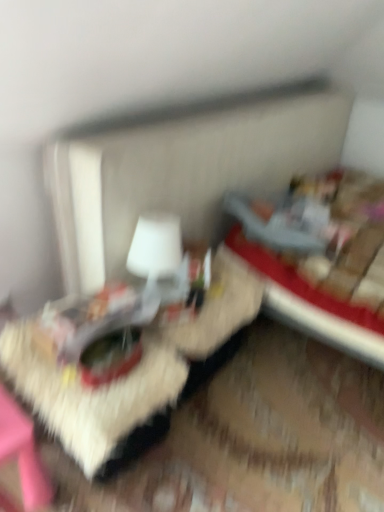
Question: Does velvet red bed at right have a lesser width compared to white matte table lamp at center?

Choices:
 (A) yes
 (B) no

Answer: (B)

Question: Does velvet red bed at right appear on the right side of white matte table lamp at center?

Choices:
 (A) no
 (B) yes

Answer: (B)

Question: Can we say velvet red bed at right lies outside white matte table lamp at center?

Choices:
 (A) no
 (B) yes

Answer: (B)

Question: Is velvet red bed at right facing away from white matte table lamp at center?

Choices:
 (A) no
 (B) yes

Answer: (A)

Question: Is velvet red bed at right shorter than white matte table lamp at center?

Choices:
 (A) yes
 (B) no

Answer: (B)

Question: From the image's perspective, is velvet red bed at right above or below white matte table lamp at center?

Choices:
 (A) below
 (B) above

Answer: (B)

Question: From a real-world perspective, is velvet red bed at right positioned above or below white matte table lamp at center?

Choices:
 (A) above
 (B) below

Answer: (B)

Question: Considering their positions, is velvet red bed at right located in front of or behind white matte table lamp at center?

Choices:
 (A) front
 (B) behind

Answer: (A)

Question: In terms of size, does velvet red bed at right appear bigger or smaller than white matte table lamp at center?

Choices:
 (A) big
 (B) small

Answer: (A)

Question: From the image's perspective, is velvet red bed at right located above or below wooden textured table at center?

Choices:
 (A) above
 (B) below

Answer: (A)

Question: Is point pyautogui.click(x=352, y=326) positioned closer to the camera than point pyautogui.click(x=114, y=406)?

Choices:
 (A) farther
 (B) closer

Answer: (A)

Question: In the image, is velvet red bed at right on the left side or the right side of wooden textured table at center?

Choices:
 (A) right
 (B) left

Answer: (A)

Question: Looking at their shapes, would you say velvet red bed at right is wider or thinner than wooden textured table at center?

Choices:
 (A) wide
 (B) thin

Answer: (B)

Question: Would you say wooden textured table at center is to the left or to the right of white matte table lamp at center in the picture?

Choices:
 (A) right
 (B) left

Answer: (A)

Question: Is wooden textured table at center bigger or smaller than white matte table lamp at center?

Choices:
 (A) small
 (B) big

Answer: (B)